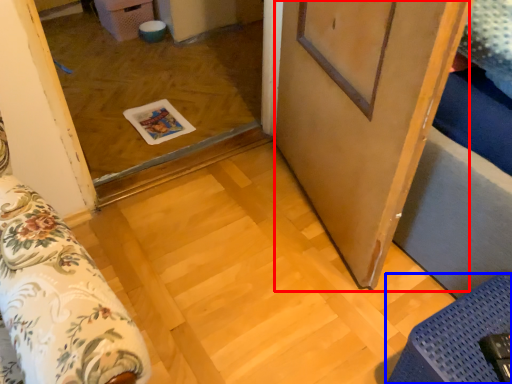
Question: Which point is closer to the camera, barn door (highlighted by a red box) or furniture (highlighted by a blue box)?

Choices:
 (A) barn door
 (B) furniture

Answer: (A)